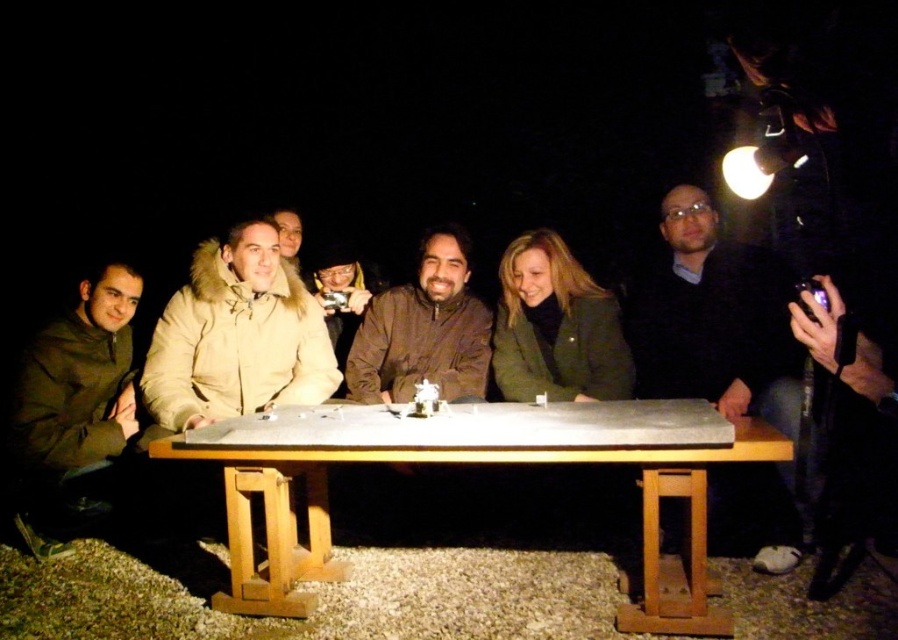
Question: Does beige fur-lined jacket at center have a smaller size compared to light beige fur coat at center?

Choices:
 (A) yes
 (B) no

Answer: (B)

Question: Which point is closer to the camera?

Choices:
 (A) (461, 278)
 (B) (781, 500)

Answer: (B)

Question: Estimate the real-world distances between objects in this image. Which object is closer to the dark blue sweater at center?

Choices:
 (A) smooth stone table at center
 (B) green matte jacket at center
 (C) beige fur-lined jacket at center

Answer: (B)

Question: Among these objects, which one is nearest to the camera?

Choices:
 (A) beige fur-lined jacket at center
 (B) green matte jacket at center

Answer: (A)

Question: Is the position of smooth stone table at center more distant than that of dark blue sweater at center?

Choices:
 (A) yes
 (B) no

Answer: (B)

Question: Is green matte jacket at left above green matte jacket at center?

Choices:
 (A) yes
 (B) no

Answer: (B)